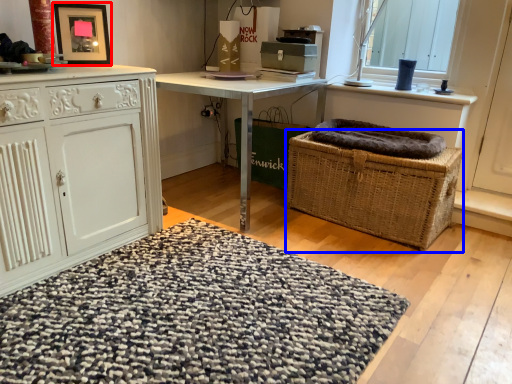
Question: Which object appears farthest to the camera in this image, picture frame (highlighted by a red box) or picnic basket (highlighted by a blue box)?

Choices:
 (A) picture frame
 (B) picnic basket

Answer: (B)